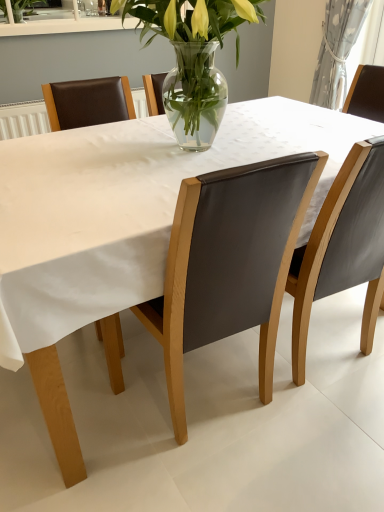
Question: Visually, is matte gray chair at right, placed as the second chair when sorted from left to right, positioned to the left or to the right of white textured curtain at upper right?

Choices:
 (A) left
 (B) right

Answer: (A)

Question: From the image's perspective, is matte gray chair at right, placed as the second chair when sorted from left to right, above or below white textured curtain at upper right?

Choices:
 (A) below
 (B) above

Answer: (A)

Question: Which object is positioned closest to the leather at center, the 2th chair viewed from the right?

Choices:
 (A) matte gray chair at right, the 1th chair in the right-to-left sequence
 (B) white textured curtain at upper right

Answer: (A)

Question: Estimate the real-world distances between objects in this image. Which object is closer to the matte gray chair at right, the 1th chair in the right-to-left sequence?

Choices:
 (A) leather at center, positioned as the first chair in left-to-right order
 (B) white textured curtain at upper right

Answer: (A)